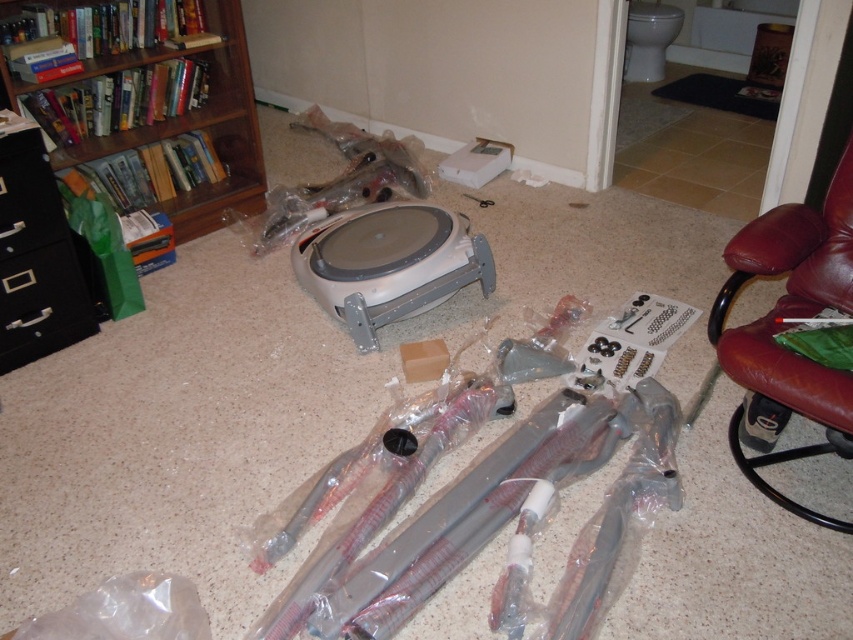
Question: Which of the following is the closest to the observer?

Choices:
 (A) brown leather armchair at right
 (B) white plastic robotic vacuum cleaner at center
 (C) black plastic drawer at left

Answer: (A)

Question: Can you confirm if wooden bookshelf at left is wider than black plastic drawer at left?

Choices:
 (A) yes
 (B) no

Answer: (A)

Question: Estimate the real-world distances between objects in this image. Which object is closer to the white plastic robotic vacuum cleaner at center?

Choices:
 (A) black plastic drawer at left
 (B) wooden bookshelf at left
 (C) brown leather armchair at right

Answer: (B)

Question: Is white plastic robotic vacuum cleaner at center further to camera compared to black plastic drawer at left?

Choices:
 (A) no
 (B) yes

Answer: (B)

Question: Which point is farther to the camera?

Choices:
 (A) (300, 264)
 (B) (235, 198)
 (C) (735, 420)

Answer: (B)

Question: Is wooden bookshelf at left positioned behind black plastic drawer at left?

Choices:
 (A) no
 (B) yes

Answer: (B)